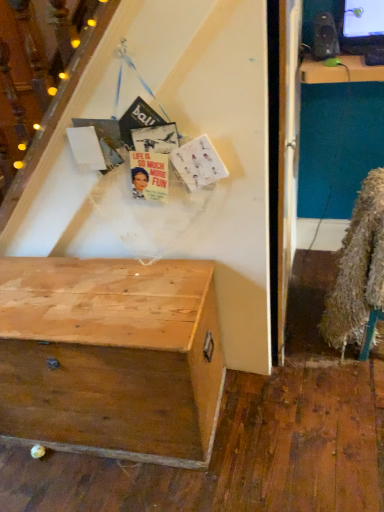
Question: From the image's perspective, is wooden chest at lower left over fuzzy brown fur coat at lower right?

Choices:
 (A) yes
 (B) no

Answer: (B)

Question: Can you see wooden chest at lower left touching fuzzy brown fur coat at lower right?

Choices:
 (A) yes
 (B) no

Answer: (B)

Question: Can you confirm if wooden chest at lower left is bigger than fuzzy brown fur coat at lower right?

Choices:
 (A) yes
 (B) no

Answer: (A)

Question: Is fuzzy brown fur coat at lower right completely or partially inside wooden chest at lower left?

Choices:
 (A) yes
 (B) no

Answer: (B)

Question: Is wooden chest at lower left thinner than fuzzy brown fur coat at lower right?

Choices:
 (A) no
 (B) yes

Answer: (B)

Question: Is point (324, 24) closer or farther from the camera than point (127, 273)?

Choices:
 (A) closer
 (B) farther

Answer: (B)

Question: Is matte black speaker at upper right taller or shorter than wooden chest at lower left?

Choices:
 (A) short
 (B) tall

Answer: (A)

Question: Is matte black speaker at upper right in front of or behind wooden chest at lower left in the image?

Choices:
 (A) behind
 (B) front

Answer: (A)

Question: Is matte black speaker at upper right wider or thinner than wooden chest at lower left?

Choices:
 (A) wide
 (B) thin

Answer: (B)

Question: Is matte black speaker at upper right to the left or to the right of fuzzy brown fur coat at lower right in the image?

Choices:
 (A) right
 (B) left

Answer: (B)

Question: From the image's perspective, is matte black speaker at upper right located above or below fuzzy brown fur coat at lower right?

Choices:
 (A) above
 (B) below

Answer: (A)

Question: Considering their positions, is matte black speaker at upper right located in front of or behind fuzzy brown fur coat at lower right?

Choices:
 (A) front
 (B) behind

Answer: (B)

Question: From a real-world perspective, is matte black speaker at upper right physically located above or below fuzzy brown fur coat at lower right?

Choices:
 (A) below
 (B) above

Answer: (B)

Question: Relative to wooden chest at lower left, is fuzzy brown fur coat at lower right in front or behind?

Choices:
 (A) front
 (B) behind

Answer: (B)

Question: From the image's perspective, relative to wooden chest at lower left, is fuzzy brown fur coat at lower right above or below?

Choices:
 (A) above
 (B) below

Answer: (A)